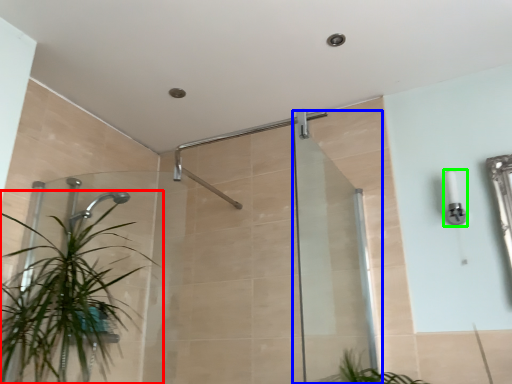
Question: Which is nearer to the houseplant (highlighted by a red box)? screen door (highlighted by a blue box) or light fixture (highlighted by a green box).

Choices:
 (A) screen door
 (B) light fixture

Answer: (A)